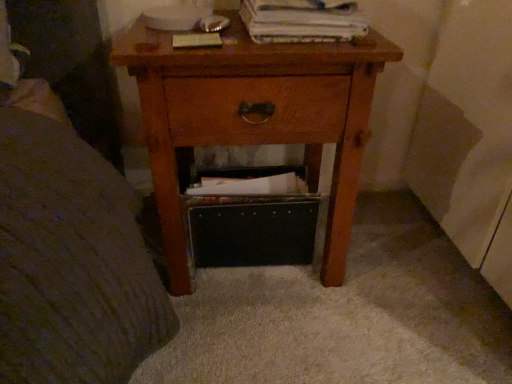
I want to click on vacant space in front of matte brown paperback book at upper center, the second paperback book from the right, so click(x=192, y=58).